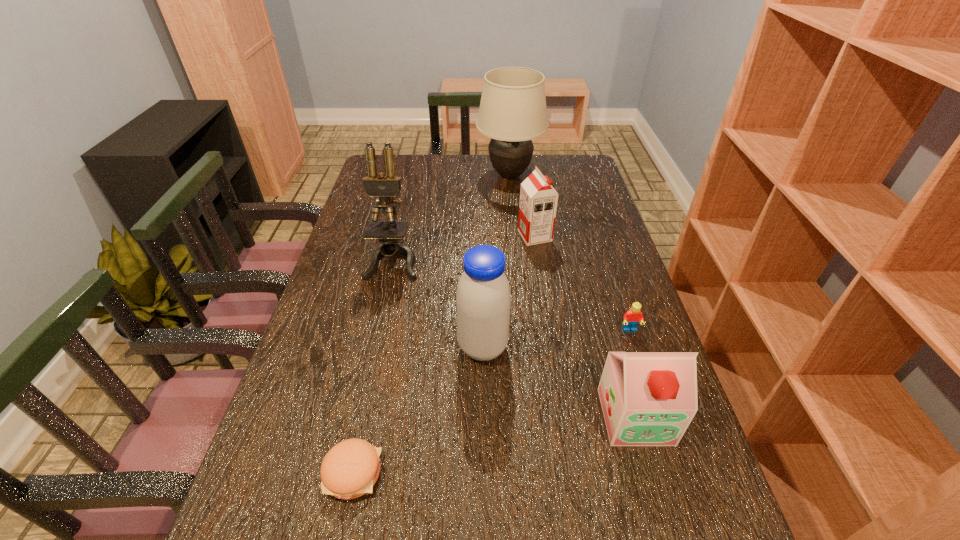
You are a GUI agent. You are given a task and a screenshot of the screen. Output one action in this format:
    pyautogui.click(x=<x>, y=<y>)
    Task: Click on the vacant region between the microscope and the Lego
    The height and width of the screenshot is (540, 960).
    Given the screenshot: What is the action you would take?
    pyautogui.click(x=512, y=295)

Locate an element on the screen. The height and width of the screenshot is (540, 960). empty location between the rightmost soya milk and the farthest soya milk is located at coordinates (585, 326).

At what (x,y) coordinates should I click in order to perform the action: click on object that stands as the third closest to the patty. Please return your answer as a coordinate pair (x, y). Image resolution: width=960 pixels, height=540 pixels. Looking at the image, I should click on (386, 186).

Identify which object is the closest to the microscope. Please provide its 2D coordinates. Your answer should be formatted as a tuple, i.e. [(x, y)], where the tuple contains the x and y coordinates of a point satisfying the conditions above.

[(483, 299)]

Where is `soya milk identified as the closest to the nearest soya milk`? The image size is (960, 540). soya milk identified as the closest to the nearest soya milk is located at coordinates (483, 299).

The height and width of the screenshot is (540, 960). Identify the location of soya milk that is the closest to the fifth shortest object. (648, 398).

The height and width of the screenshot is (540, 960). Identify the location of free space that satisfies the following two spatial constraints: 1. at the eyepieces of the shortest object; 2. on the left side of the microscope. (346, 472).

Image resolution: width=960 pixels, height=540 pixels. I want to click on blank space that satisfies the following two spatial constraints: 1. on the back side of the shortest object; 2. on the left side of the third tallest object, so click(379, 348).

Find the location of a particular element. The width and height of the screenshot is (960, 540). free spot that satisfies the following two spatial constraints: 1. on the back side of the second farthest soya milk; 2. on the left side of the lampshade is located at coordinates (482, 175).